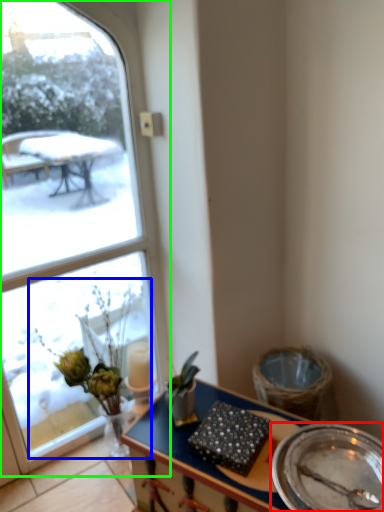
Question: Based on their relative distances, which object is farther from plate (highlighted by a red box)? Choose from floral arrangement (highlighted by a blue box) and window (highlighted by a green box).

Choices:
 (A) floral arrangement
 (B) window

Answer: (B)